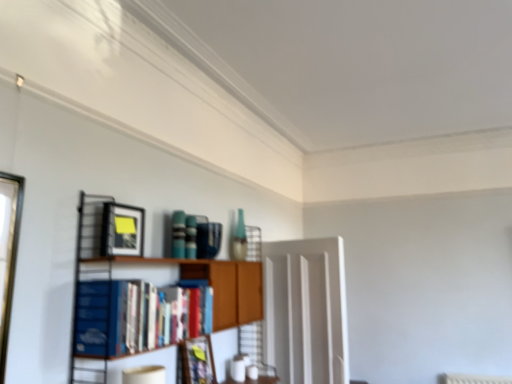
Question: Does matte black picture frame at center, marked as the first picture frame in a right-to-left arrangement, have a greater width compared to matte black picture frame at upper left, which appears as the 2th picture frame when viewed from the back?

Choices:
 (A) no
 (B) yes

Answer: (B)

Question: Could matte black picture frame at upper left, positioned as the 1th picture frame in left-to-right order, be considered to be inside matte black picture frame at center, which appears as the second picture frame when viewed from the top?

Choices:
 (A) no
 (B) yes

Answer: (A)

Question: Considering the relative positions of matte black picture frame at center, acting as the 2th picture frame starting from the front, and matte black picture frame at upper left, positioned as the 1th picture frame in left-to-right order, in the image provided, is matte black picture frame at center, acting as the 2th picture frame starting from the front, in front of matte black picture frame at upper left, positioned as the 1th picture frame in left-to-right order,?

Choices:
 (A) no
 (B) yes

Answer: (A)

Question: Is matte black picture frame at center, acting as the 2th picture frame starting from the front, at the left side of matte black picture frame at upper left, which is the 2th picture frame from right to left?

Choices:
 (A) yes
 (B) no

Answer: (B)

Question: Is matte black picture frame at center, arranged as the second picture frame when viewed from the left, aimed at matte black picture frame at upper left, which appears as the 2th picture frame when viewed from the back?

Choices:
 (A) no
 (B) yes

Answer: (A)

Question: Is matte black picture frame at center, arranged as the second picture frame when viewed from the left, taller than matte black picture frame at upper left, marked as the 2th picture frame in a bottom-to-top arrangement?

Choices:
 (A) no
 (B) yes

Answer: (B)

Question: Is wooden bookshelf at center at the left side of blue hardcover book at left?

Choices:
 (A) yes
 (B) no

Answer: (B)

Question: From a real-world perspective, is wooden bookshelf at center under blue hardcover book at left?

Choices:
 (A) yes
 (B) no

Answer: (A)

Question: Is the depth of wooden bookshelf at center less than that of blue hardcover book at left?

Choices:
 (A) yes
 (B) no

Answer: (A)

Question: Considering the relative sizes of wooden bookshelf at center and blue hardcover book at left in the image provided, is wooden bookshelf at center wider than blue hardcover book at left?

Choices:
 (A) yes
 (B) no

Answer: (A)

Question: Can you confirm if wooden bookshelf at center is smaller than blue hardcover book at left?

Choices:
 (A) no
 (B) yes

Answer: (A)

Question: From the image's perspective, is wooden bookshelf at center below blue hardcover book at left?

Choices:
 (A) no
 (B) yes

Answer: (B)

Question: Is blue hardcover book at left at the right side of matte black picture frame at upper left, marked as the 2th picture frame in a bottom-to-top arrangement?

Choices:
 (A) no
 (B) yes

Answer: (B)